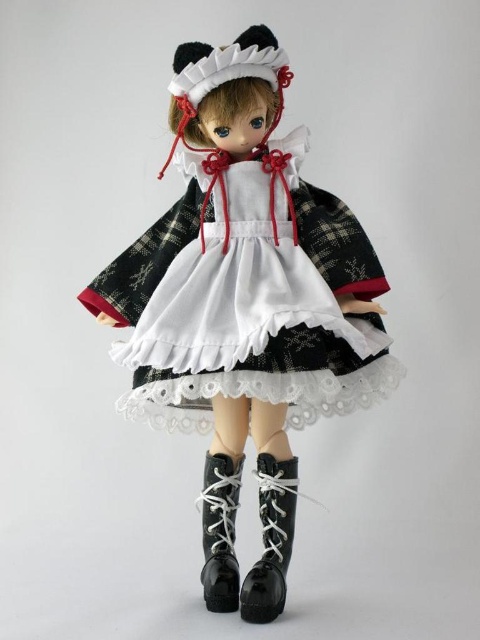
Question: Observing the image, what is the correct spatial positioning of matte black dress at center in reference to black rubber boot at lower center?

Choices:
 (A) left
 (B) right

Answer: (A)

Question: Is matte black dress at center further to the viewer compared to black leather boot at center?

Choices:
 (A) no
 (B) yes

Answer: (A)

Question: Which of the following is the farthest from the observer?

Choices:
 (A) matte black dress at center
 (B) black rubber boot at lower center
 (C) black leather boot at center

Answer: (C)

Question: Which point is closer to the camera?

Choices:
 (A) (337, 232)
 (B) (261, 464)

Answer: (A)

Question: Which point appears farthest from the camera in this image?

Choices:
 (A) (296, 483)
 (B) (218, 566)
 (C) (272, 477)

Answer: (A)

Question: Does matte black dress at center have a smaller size compared to black leather boot at center?

Choices:
 (A) no
 (B) yes

Answer: (A)